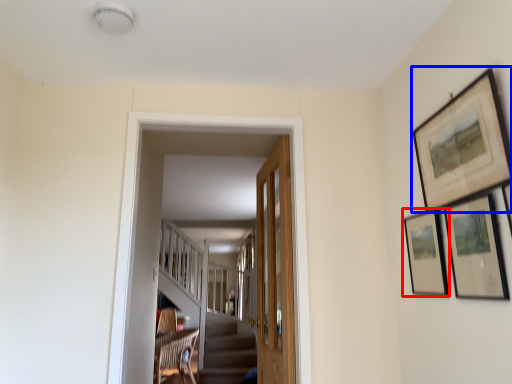
Question: Which object appears farthest to the camera in this image, picture frame (highlighted by a red box) or picture frame (highlighted by a blue box)?

Choices:
 (A) picture frame
 (B) picture frame

Answer: (A)